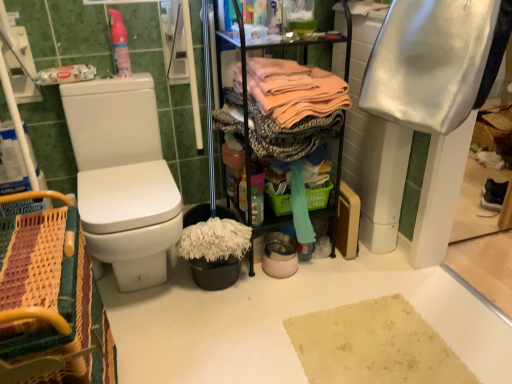
This screenshot has width=512, height=384. Find the location of `vacant space in front of black plastic bucket at lower center`. vacant space in front of black plastic bucket at lower center is located at coordinates (x=205, y=319).